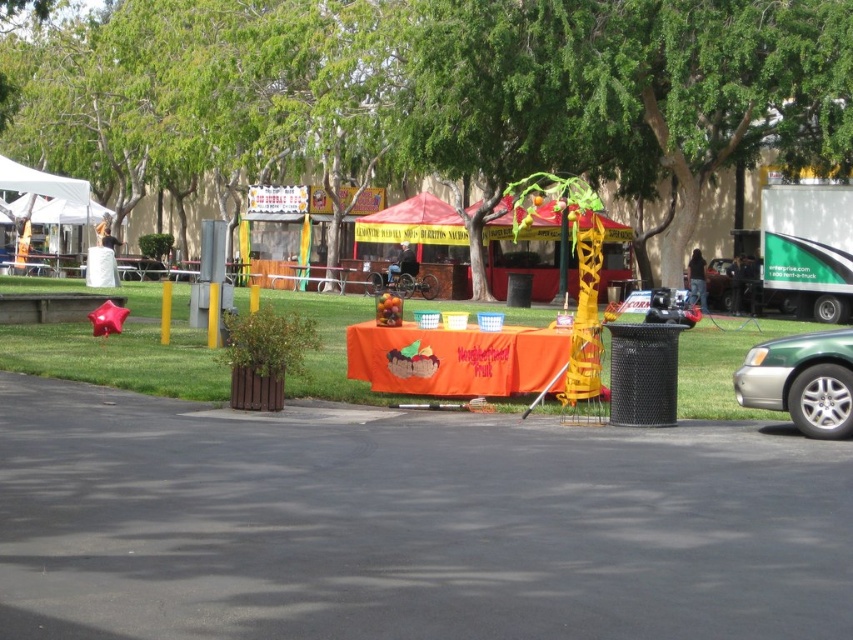
You are standing at the event and want to take a photo that includes both the point at location (564, 131) and the point at (836, 330). Considering their positions, which point should you focus on first to ensure both are in focus?

You should focus on the point at (564, 131) first because it is closer to the camera than the point at (836, 330). This ensures that both points will be within the depth of field when taking the photo.

You are standing at the center of the paved area in front of the orange tablecloth. Which direction should you walk to reach the green leafy tree at center?

The green leafy tree at center is located at point (440, 90), so you should walk towards the center to reach it.

You are attending the outdoor event and want to take a photo of the green leafy tree at center and the green metallic car at lower right. Which object should you focus on first if you want both to be in clear focus?

You should focus on the green leafy tree at center first because it is closer to you than the green metallic car at lower right. Since it is nearer, focusing on it will ensure both are in focus as the car is further away.